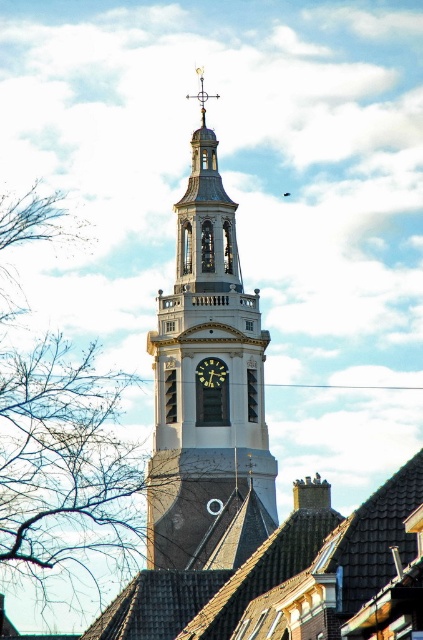
Is polished brass clock tower at center taller than bare branches at left?

Correct, polished brass clock tower at center is much taller as bare branches at left.

Does point (205, 308) lie in front of point (16, 227)?

Yes, it is.

Between point (164, 353) and point (58, 541), which one is positioned behind?

Positioned behind is point (58, 541).

You are a GUI agent. You are given a task and a screenshot of the screen. Output one action in this format:
    pyautogui.click(x=<x>, y=<y>)
    Task: Click on the polished brass clock tower at center
    Image resolution: width=423 pixels, height=640 pixels.
    Given the screenshot: What is the action you would take?
    pyautogui.click(x=200, y=384)

Can you confirm if polished brass clock tower at center is positioned above matte black clock at center?

Indeed, polished brass clock tower at center is positioned over matte black clock at center.

Which is more to the right, polished brass clock tower at center or matte black clock at center?

Positioned to the right is polished brass clock tower at center.

Is point (203, 157) less distant than point (200, 365)?

No, (203, 157) is behind (200, 365).

Where is `polished brass clock tower at center`? The image size is (423, 640). polished brass clock tower at center is located at coordinates (200, 384).

Is bare branches at left to the left of matte black clock at center from the viewer's perspective?

Yes, bare branches at left is to the left of matte black clock at center.

Is point (21, 388) positioned before point (197, 371)?

No, it is behind (197, 371).

At what (x,y) coordinates should I click in order to perform the action: click on bare branches at left. Please return your answer as a coordinate pair (x, y). This screenshot has height=640, width=423. Looking at the image, I should click on (63, 465).